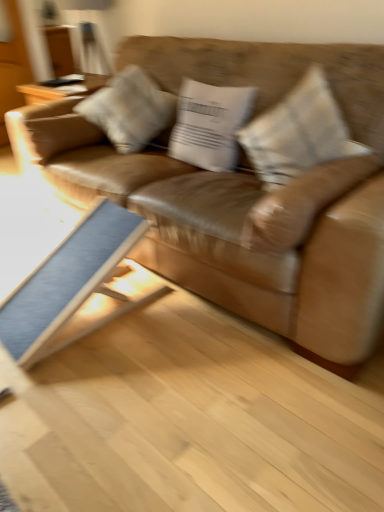
Question: Is blue fabric table at lower left aimed at brown leather couch at center?

Choices:
 (A) yes
 (B) no

Answer: (B)

Question: Is blue fabric table at lower left turned away from brown leather couch at center?

Choices:
 (A) no
 (B) yes

Answer: (B)

Question: Does blue fabric table at lower left come in front of brown leather couch at center?

Choices:
 (A) no
 (B) yes

Answer: (A)

Question: Can you confirm if blue fabric table at lower left is bigger than brown leather couch at center?

Choices:
 (A) yes
 (B) no

Answer: (B)

Question: From a real-world perspective, is blue fabric table at lower left positioned over brown leather couch at center based on gravity?

Choices:
 (A) yes
 (B) no

Answer: (B)

Question: Is textured beige pillow at center, acting as the 1th pillow starting from the right, bigger or smaller than blue fabric table at lower left?

Choices:
 (A) big
 (B) small

Answer: (B)

Question: Is textured beige pillow at center, which is the 3th pillow in left-to-right order, spatially inside blue fabric table at lower left, or outside of it?

Choices:
 (A) inside
 (B) outside

Answer: (B)

Question: From a real-world perspective, is textured beige pillow at center, acting as the 1th pillow starting from the right, physically located above or below blue fabric table at lower left?

Choices:
 (A) above
 (B) below

Answer: (A)

Question: Is point (284, 168) positioned closer to the camera than point (29, 351)?

Choices:
 (A) closer
 (B) farther

Answer: (B)

Question: From a real-world perspective, relative to white cotton pillow at center, arranged as the second pillow when viewed from the right, is blue fabric table at lower left vertically above or below?

Choices:
 (A) below
 (B) above

Answer: (A)

Question: From their relative heights in the image, would you say blue fabric table at lower left is taller or shorter than white cotton pillow at center, arranged as the second pillow when viewed from the right?

Choices:
 (A) short
 (B) tall

Answer: (B)

Question: Which is correct: blue fabric table at lower left is inside white cotton pillow at center, the 2th pillow positioned from the left, or outside of it?

Choices:
 (A) outside
 (B) inside

Answer: (A)

Question: From the image's perspective, is blue fabric table at lower left positioned above or below white cotton pillow at center, arranged as the second pillow when viewed from the right?

Choices:
 (A) below
 (B) above

Answer: (A)

Question: Is point (312, 152) positioned closer to the camera than point (195, 124)?

Choices:
 (A) closer
 (B) farther

Answer: (A)

Question: Which is correct: textured beige pillow at center, acting as the 1th pillow starting from the right, is inside white cotton pillow at center, the 2th pillow positioned from the left, or outside of it?

Choices:
 (A) outside
 (B) inside

Answer: (A)